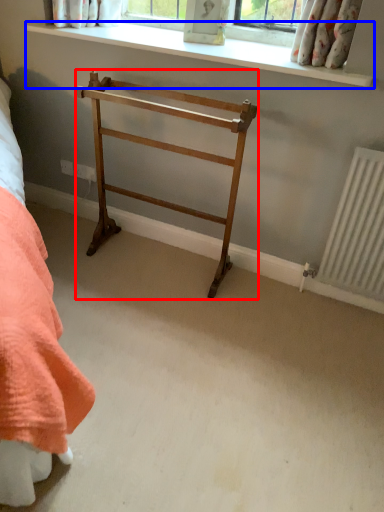
Question: Which object appears closest to the camera in this image, furniture (highlighted by a red box) or window sill (highlighted by a blue box)?

Choices:
 (A) furniture
 (B) window sill

Answer: (A)